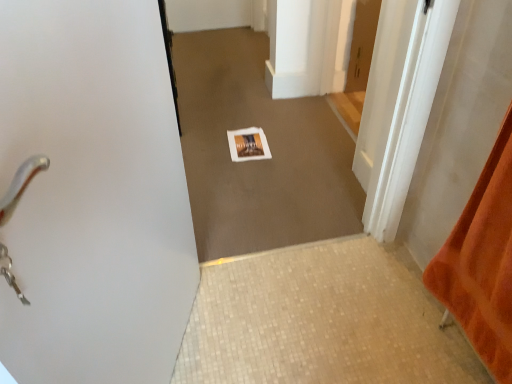
This screenshot has height=384, width=512. I want to click on vacant region below orange fabric at right (from a real-world perspective), so click(x=447, y=346).